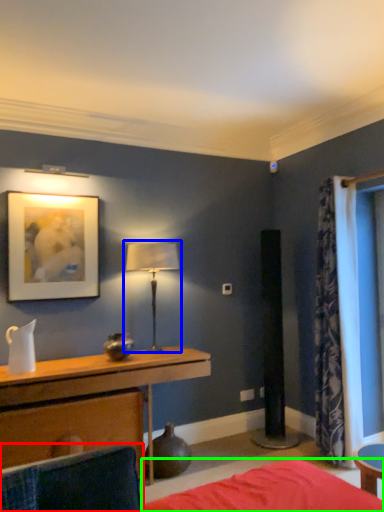
Question: Considering the real-world distances, which object is closest to swivel chair (highlighted by a red box)? table lamp (highlighted by a blue box) or bed frame (highlighted by a green box).

Choices:
 (A) table lamp
 (B) bed frame

Answer: (B)